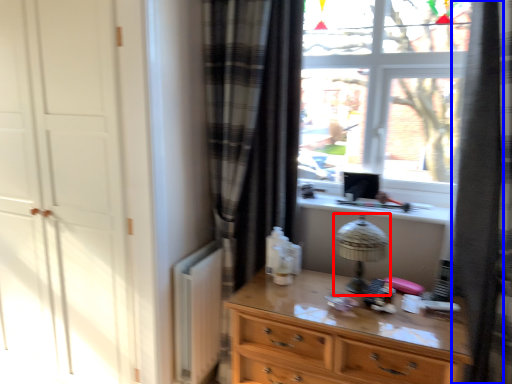
Question: Which point is further to the camera, table lamp (highlighted by a red box) or shower curtain (highlighted by a blue box)?

Choices:
 (A) table lamp
 (B) shower curtain

Answer: (A)